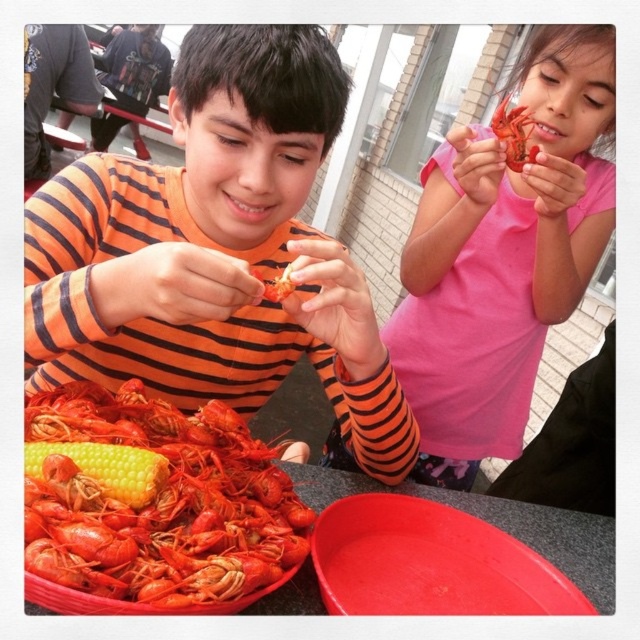
Question: Is yellow matte corn at lower left thinner than red matte lobster at upper right?

Choices:
 (A) yes
 (B) no

Answer: (A)

Question: Which of the following is the farthest from the observer?

Choices:
 (A) (218, 504)
 (B) (552, 51)
 (C) (24, 474)

Answer: (B)

Question: Which object appears closest to the camera in this image?

Choices:
 (A) yellow matte corn at lower left
 (B) red matte lobster at upper right
 (C) shiny red lobster at lower left

Answer: (C)

Question: Is pink matte crayfish at upper right below shiny red lobster at lower left?

Choices:
 (A) no
 (B) yes

Answer: (A)

Question: Which object is positioned farthest from the orange striped shirt at center?

Choices:
 (A) pink matte crayfish at upper right
 (B) yellow matte corn at lower left

Answer: (A)

Question: Can you confirm if orange striped shirt at center is wider than yellow matte corn at lower left?

Choices:
 (A) yes
 (B) no

Answer: (A)